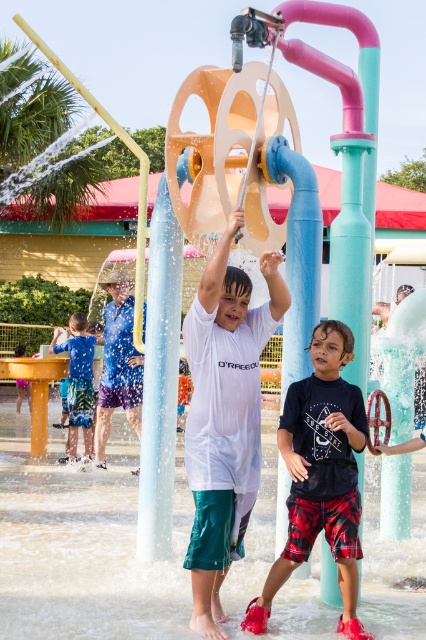
Which of these two, clear plastic water at center or black cotton t-shirt at center, stands taller?

black cotton t-shirt at center is taller.

Which is more to the left, clear plastic water at center or black cotton t-shirt at center?

clear plastic water at center is more to the left.

What are the coordinates of `clear plastic water at center` in the screenshot? It's located at (85, 545).

Does black cotton t-shirt at center appear under matte white shirt at center?

Actually, black cotton t-shirt at center is above matte white shirt at center.

Can you confirm if black cotton t-shirt at center is smaller than matte white shirt at center?

No.

The width and height of the screenshot is (426, 640). In order to click on black cotton t-shirt at center in this screenshot , I will do `click(321, 474)`.

Locate an element on the screen. The width and height of the screenshot is (426, 640). black cotton t-shirt at center is located at coordinates (321, 474).

Is point (331, 486) farther from camera compared to point (86, 429)?

No, it is not.

This screenshot has height=640, width=426. What do you see at coordinates (321, 474) in the screenshot?
I see `black cotton t-shirt at center` at bounding box center [321, 474].

Does point (316, 520) come behind point (91, 429)?

No, (316, 520) is in front of (91, 429).

I want to click on black cotton t-shirt at center, so click(321, 474).